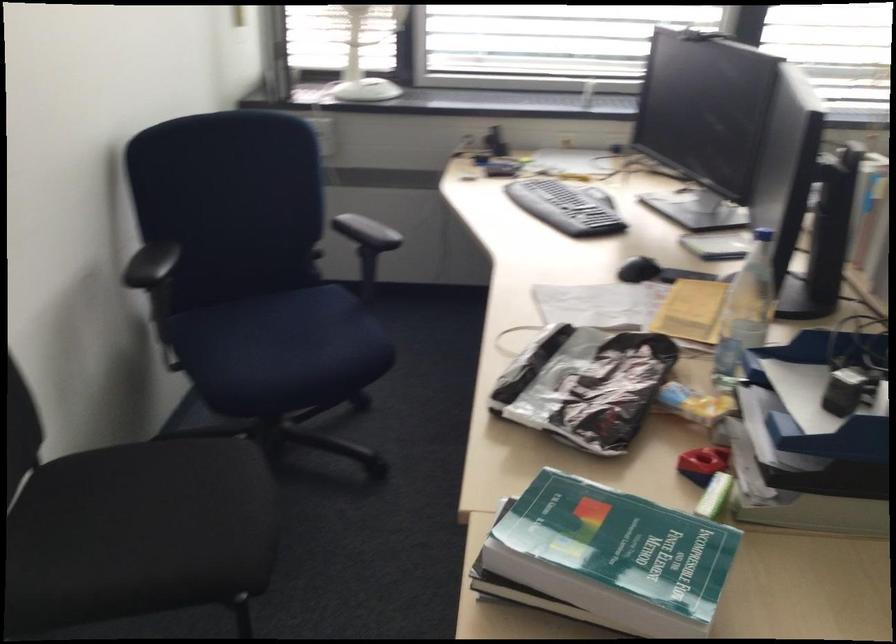
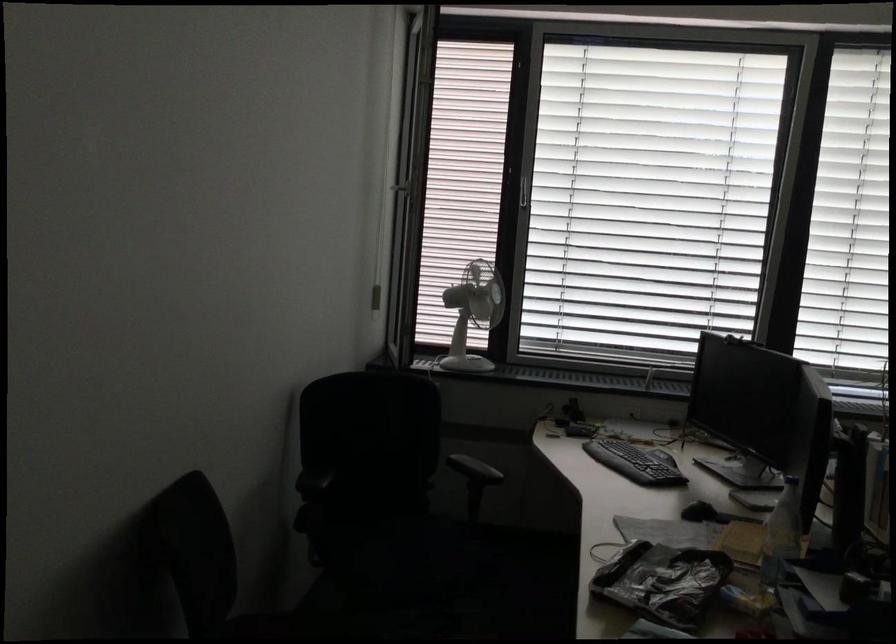
In a continuous first-person perspective shot, in which direction is the camera moving?

The cameraman moved toward left, backward.